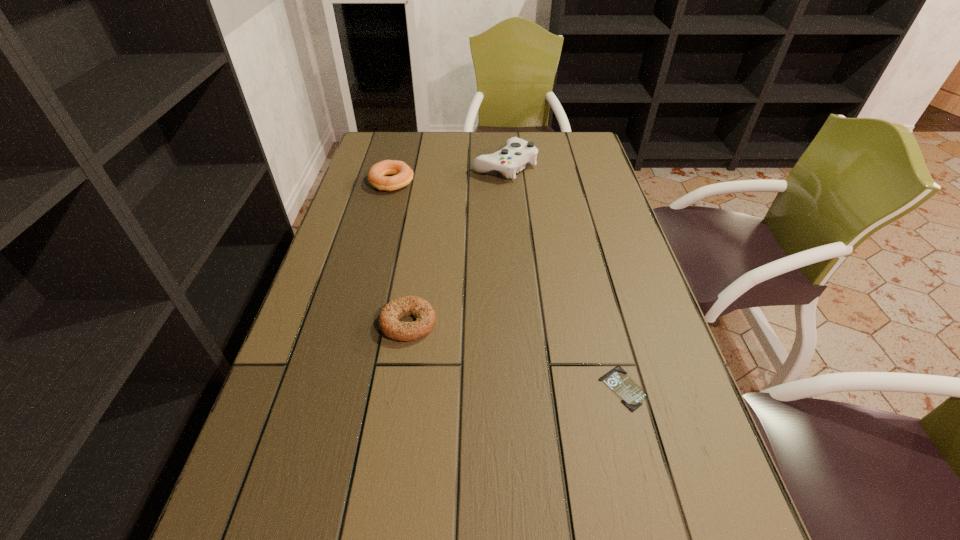
You are a GUI agent. You are given a task and a screenshot of the screen. Output one action in this format:
    pyautogui.click(x=<x>, y=<y>)
    Task: Click on the empty space between the nearer bagel and the nearest object
    
    Given the screenshot: What is the action you would take?
    pyautogui.click(x=516, y=356)

Where is `free spot between the nearer bagel and the second tallest object`? free spot between the nearer bagel and the second tallest object is located at coordinates (400, 253).

Identify the location of free space between the second nearest object and the taller bagel. (400, 253).

The height and width of the screenshot is (540, 960). I want to click on unoccupied position between the second object from right to left and the farther bagel, so click(x=448, y=174).

You are a GUI agent. You are given a task and a screenshot of the screen. Output one action in this format:
    pyautogui.click(x=<x>, y=<y>)
    Task: Click on the vacant area that lies between the farther bagel and the tallest object
    This screenshot has width=960, height=540.
    Given the screenshot: What is the action you would take?
    pyautogui.click(x=448, y=174)

What are the coordinates of `empty space that is in between the shorter bagel and the taller bagel` in the screenshot? It's located at (400, 253).

Find the location of a particular element. This screenshot has width=960, height=540. vacant space in between the second shortest object and the second object from right to left is located at coordinates (456, 245).

The image size is (960, 540). I want to click on free point between the farther bagel and the control, so click(448, 174).

What are the coordinates of `unoccupied position between the nearest object and the control` in the screenshot? It's located at (564, 277).

At what (x,y) coordinates should I click in order to perform the action: click on the closest object relative to the second tallest object. Please return your answer as a coordinate pair (x, y). The width and height of the screenshot is (960, 540). Looking at the image, I should click on (517, 152).